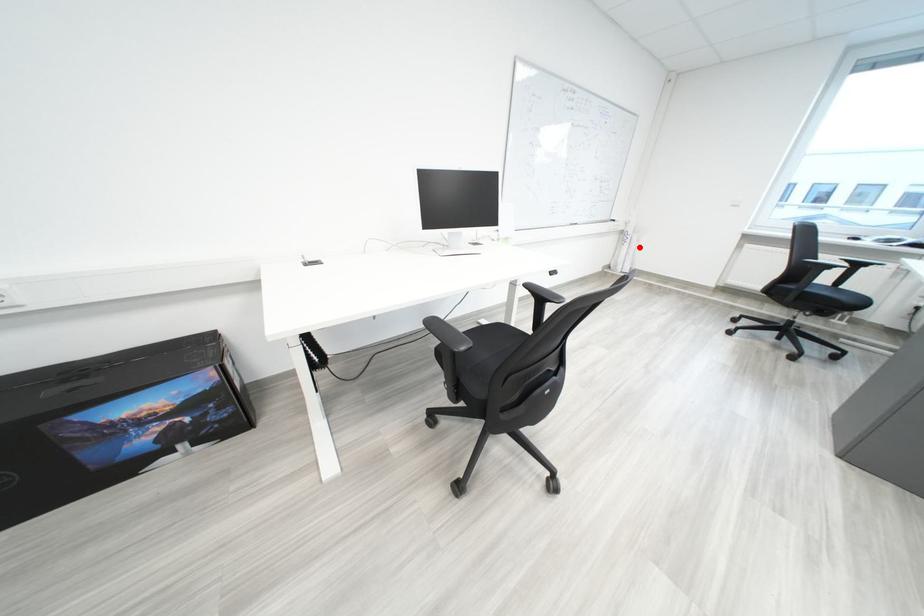
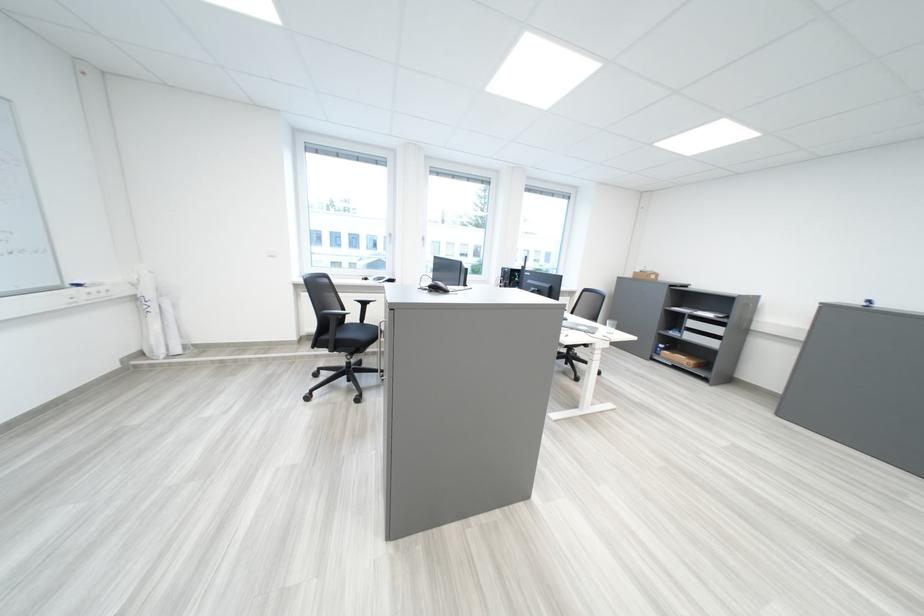
Question: I am providing you with two images of the same scene from different viewpoints. Given a red point in image1, look at the same physical point in image2. Is it:

Choices:
 (A) Closer to the viewpoint
 (B) Farther from the viewpoint

Answer: (B)